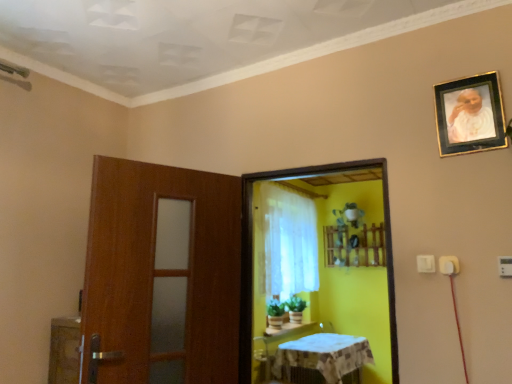
Question: Considering the relative sizes of white textured tablecloth at lower center and white sheer curtain at center in the image provided, is white textured tablecloth at lower center shorter than white sheer curtain at center?

Choices:
 (A) yes
 (B) no

Answer: (A)

Question: Can you confirm if white textured tablecloth at lower center is smaller than white sheer curtain at center?

Choices:
 (A) no
 (B) yes

Answer: (A)

Question: From the image's perspective, would you say white textured tablecloth at lower center is shown under white sheer curtain at center?

Choices:
 (A) no
 (B) yes

Answer: (B)

Question: Could you tell me if white textured tablecloth at lower center is turned towards white sheer curtain at center?

Choices:
 (A) yes
 (B) no

Answer: (B)

Question: Can you confirm if white textured tablecloth at lower center is thinner than white sheer curtain at center?

Choices:
 (A) no
 (B) yes

Answer: (A)

Question: Can you confirm if white textured tablecloth at lower center is taller than white sheer curtain at center?

Choices:
 (A) yes
 (B) no

Answer: (B)

Question: Can you confirm if white textured tablecloth at lower center is smaller than gold-framed photo at upper right?

Choices:
 (A) yes
 (B) no

Answer: (B)

Question: From the image's perspective, would you say white textured tablecloth at lower center is shown under gold-framed photo at upper right?

Choices:
 (A) yes
 (B) no

Answer: (A)

Question: Does white textured tablecloth at lower center appear on the right side of gold-framed photo at upper right?

Choices:
 (A) no
 (B) yes

Answer: (A)

Question: Is white textured tablecloth at lower center taller than gold-framed photo at upper right?

Choices:
 (A) no
 (B) yes

Answer: (B)

Question: From the image's perspective, is white textured tablecloth at lower center on top of gold-framed photo at upper right?

Choices:
 (A) yes
 (B) no

Answer: (B)

Question: From a real-world perspective, is white textured tablecloth at lower center positioned under gold-framed photo at upper right based on gravity?

Choices:
 (A) no
 (B) yes

Answer: (B)

Question: From the image's perspective, is white sheer curtain at center on top of white glossy table at lower center?

Choices:
 (A) yes
 (B) no

Answer: (A)